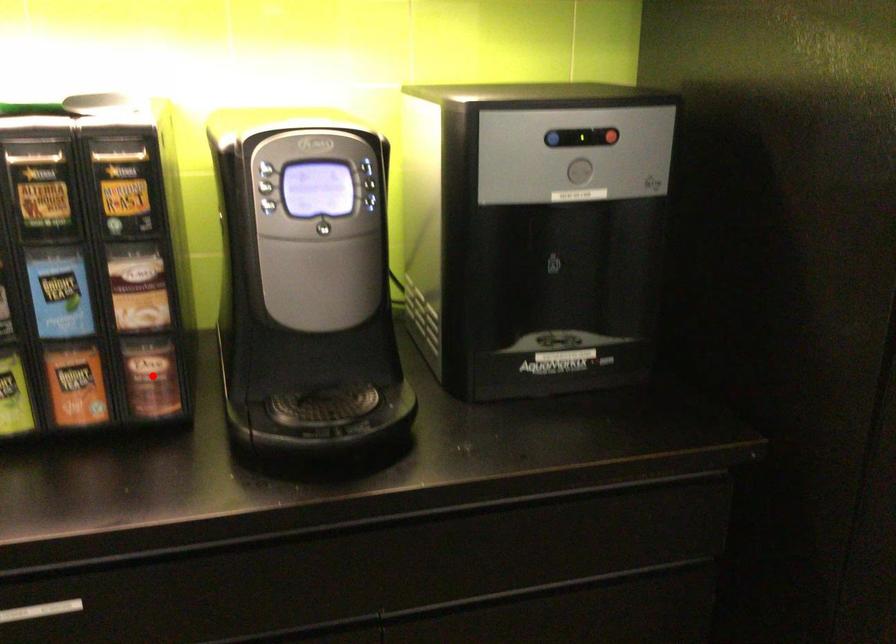
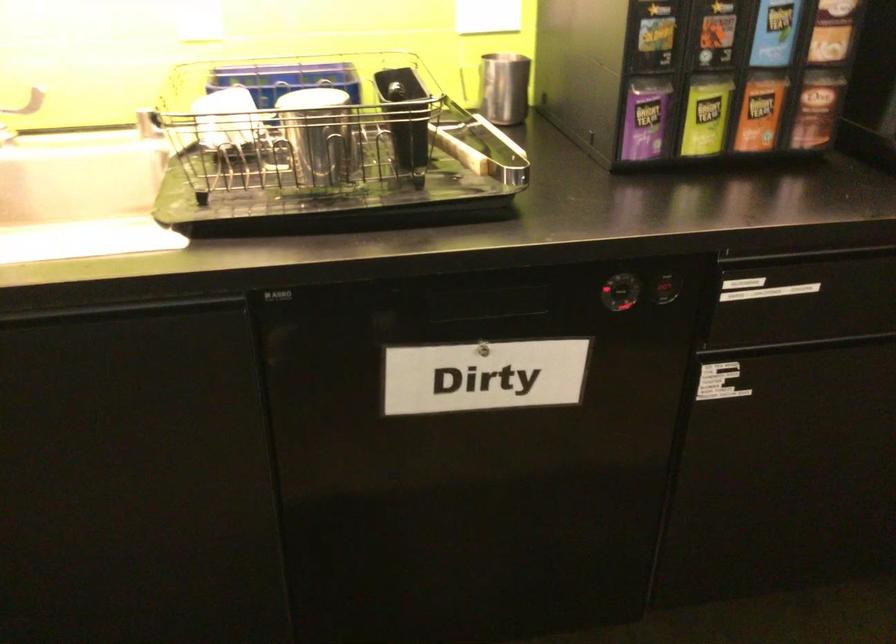
Question: I am providing you with two images of the same scene from different viewpoints. Given a red point in image1, look at the same physical point in image2. Is it:

Choices:
 (A) Closer to the viewpoint
 (B) Farther from the viewpoint

Answer: (B)